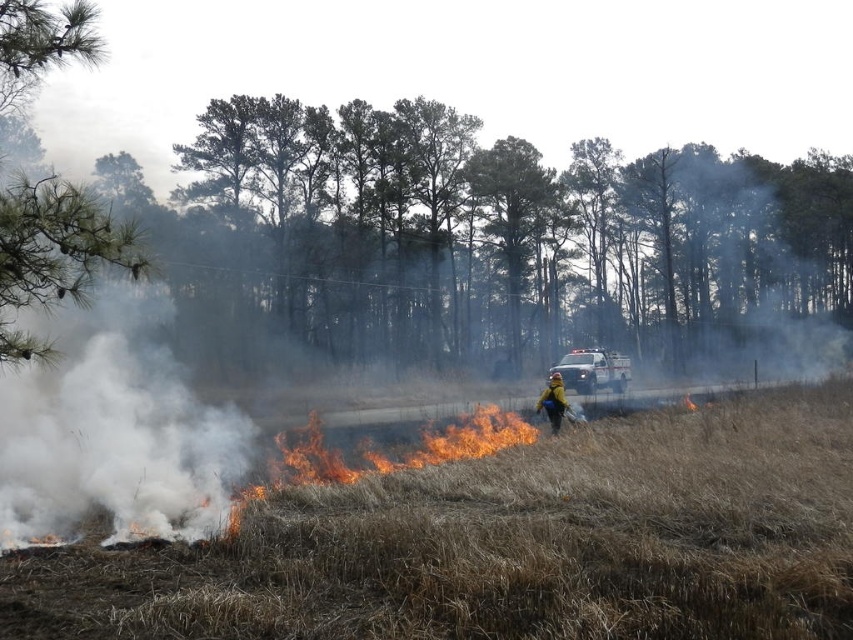
Question: Which point is closer to the camera?

Choices:
 (A) white glossy ambulance at center
 (B) yellow-green reflective jacket at center
 (C) brown dry grass at center

Answer: (C)

Question: Does brown dry grass at center have a lesser width compared to yellow-green reflective jacket at center?

Choices:
 (A) yes
 (B) no

Answer: (B)

Question: Among these points, which one is nearest to the camera?

Choices:
 (A) (566, 387)
 (B) (538, 410)

Answer: (B)

Question: Which of the following is the closest to the observer?

Choices:
 (A) yellow-green reflective jacket at center
 (B) white glossy ambulance at center
 (C) brown dry grass at center

Answer: (C)

Question: Can you confirm if brown dry grass at center is wider than yellow-green reflective jacket at center?

Choices:
 (A) yes
 (B) no

Answer: (A)

Question: Does brown dry grass at center have a smaller size compared to yellow-green reflective jacket at center?

Choices:
 (A) yes
 (B) no

Answer: (A)